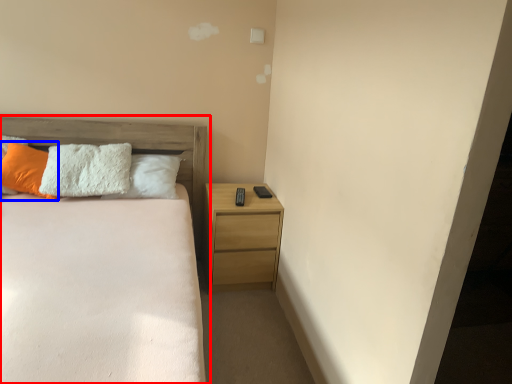
Question: Which object is closer to the camera taking this photo, bed (highlighted by a red box) or pillow (highlighted by a blue box)?

Choices:
 (A) bed
 (B) pillow

Answer: (A)